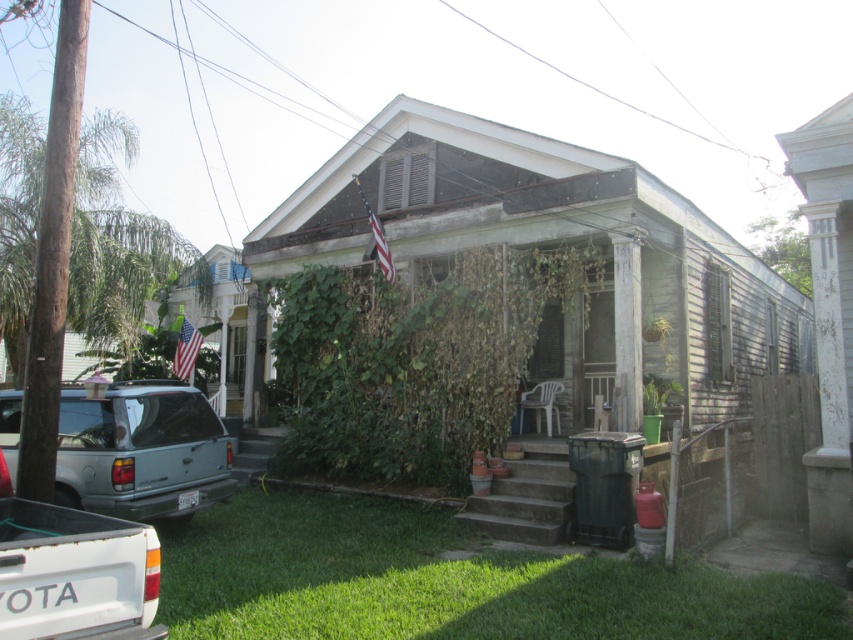
You are a delivery person trying to park your delivery van between the metallic silver suv at lower left and the white matte truck at lower left. Your van is 2.5 meters wide. Can you fit your van between them?

The metallic silver suv at lower left might be wider than the white matte truck at lower left, so there might not be enough space for your 2.5 meter wide van between them.

You are a delivery driver with a 2.5 meter wide truck. You need to park your truck between the metallic silver suv at lower left and the white matte truck at lower left. Is there enough space between them to park your truck?

The metallic silver suv at lower left and white matte truck at lower left are 3.28 meters apart from each other. Since your truck is 2.5 meters wide, there is sufficient space to park between them as 3.28 meters is greater than 2.5 meters.